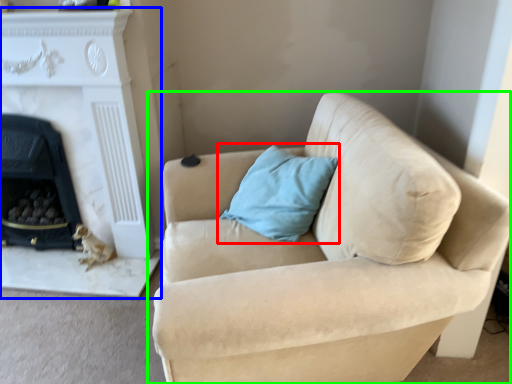
Question: Considering the real-world distances, which object is closest to pillow (highlighted by a red box)? fireplace (highlighted by a blue box) or studio couch (highlighted by a green box).

Choices:
 (A) fireplace
 (B) studio couch

Answer: (B)